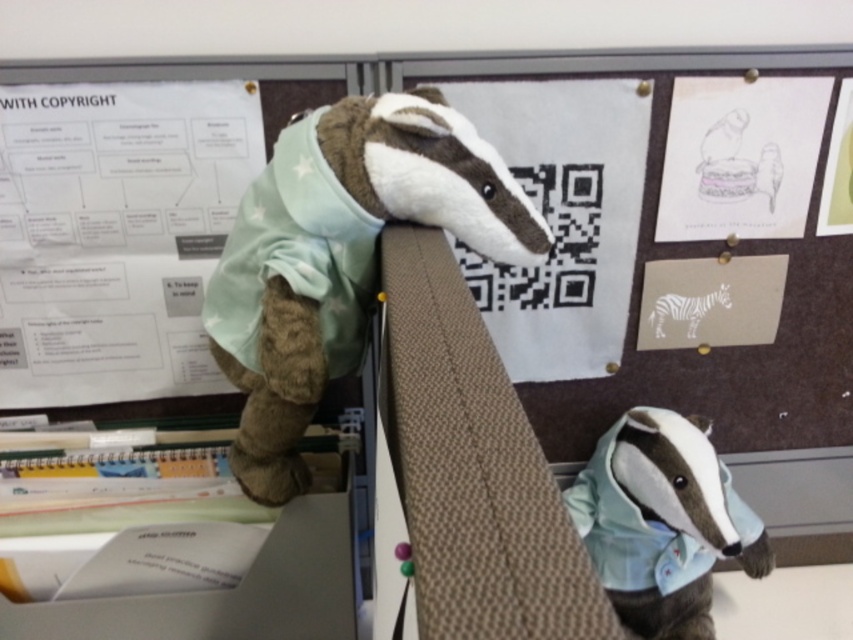
Question: Can you confirm if white paper at upper left is positioned to the left of fuzzy brown badger at upper left?

Choices:
 (A) no
 (B) yes

Answer: (B)

Question: Does fuzzy brown plush toy at upper center come behind white paper at center?

Choices:
 (A) yes
 (B) no

Answer: (B)

Question: Which is farther from the fuzzy brown plush toy at upper center?

Choices:
 (A) white paper at upper right
 (B) white paper at upper left

Answer: (A)

Question: Among these points, which one is farthest from the camera?

Choices:
 (A) (329, 182)
 (B) (712, 632)

Answer: (B)

Question: Which object appears closest to the camera in this image?

Choices:
 (A) fuzzy brown plush toy at upper center
 (B) white paper at center

Answer: (A)

Question: Is white paper at center bigger than fuzzy brown badger at upper left?

Choices:
 (A) yes
 (B) no

Answer: (B)